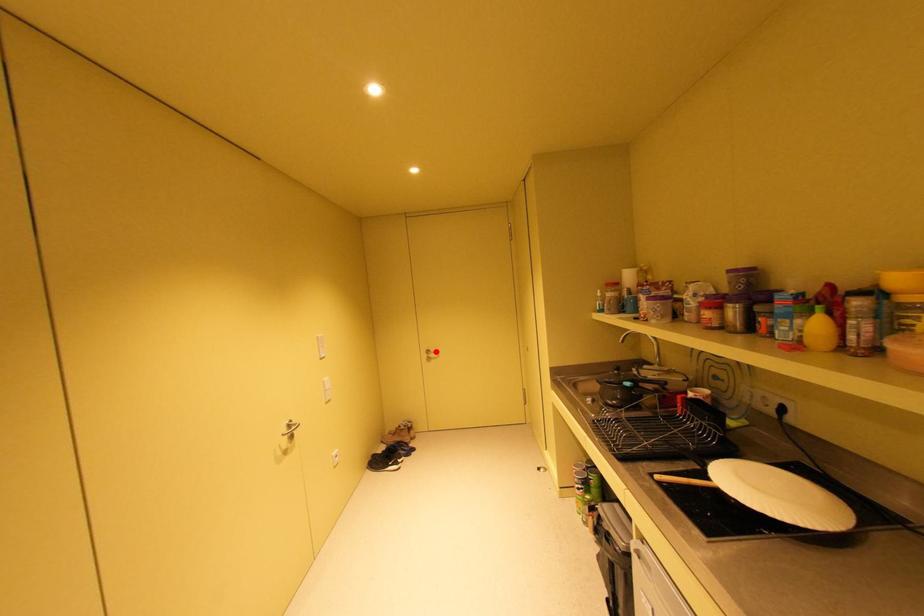
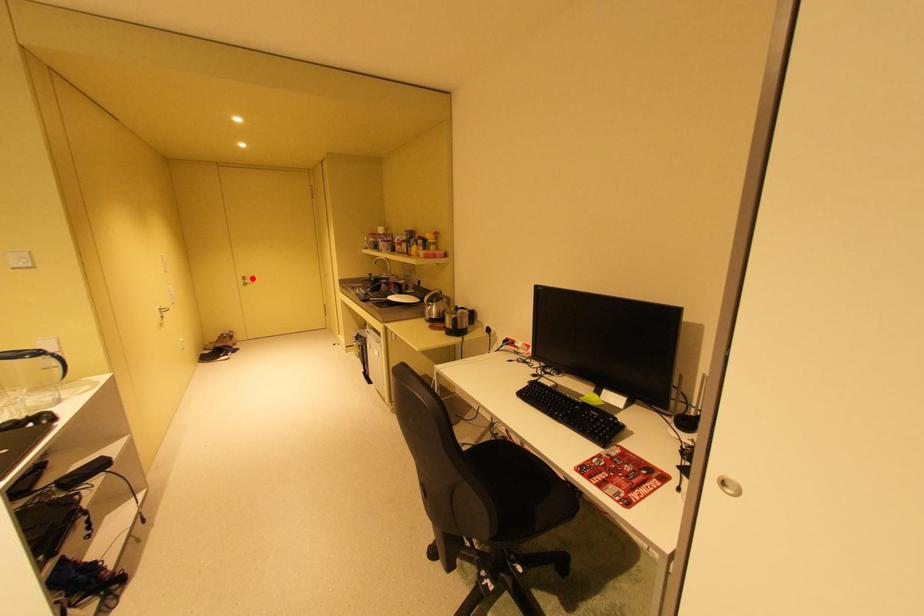
I am providing you with two images of the same scene from different viewpoints. A red point is marked on the first image and another point is marked on the second image. Are the points marked in image1 and image2 representing the same 3D position?

Yes